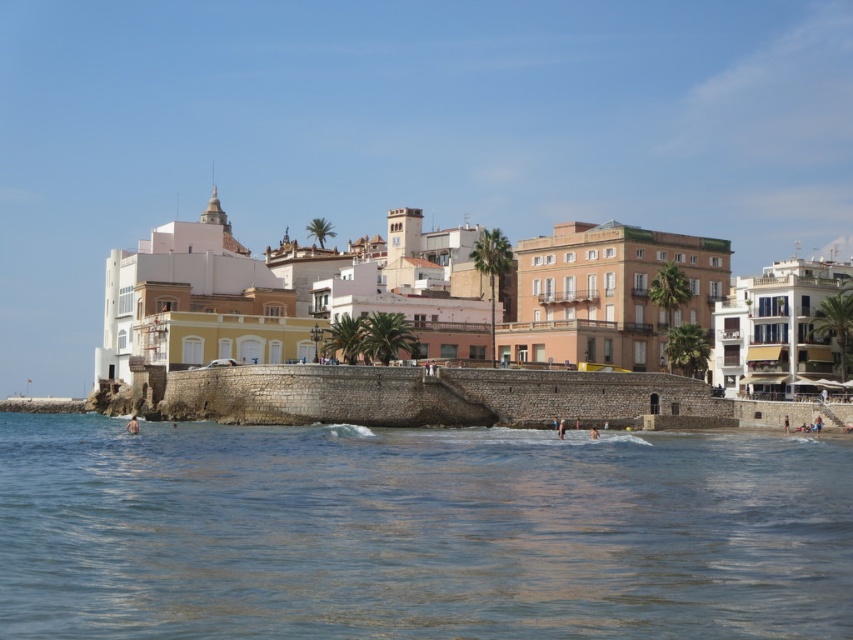
You are standing at the center of the seawall in the coastal scene. If you look towards the clear blue water at lower center, in which direction should you walk to reach it?

Since the clear blue water at lower center is located at point [418,532], you should walk towards the lower center direction to reach it.

You are standing on the stone seawall in the coastal scene. You see two points marked on the image. The first point is at coordinate point (x=53, y=435) and the second is at point (x=294, y=346). Which of these two points is closer to you as you stand on the seawall?

Point (x=53, y=435) is in front of point (x=294, y=346), so the first point is closer to you.